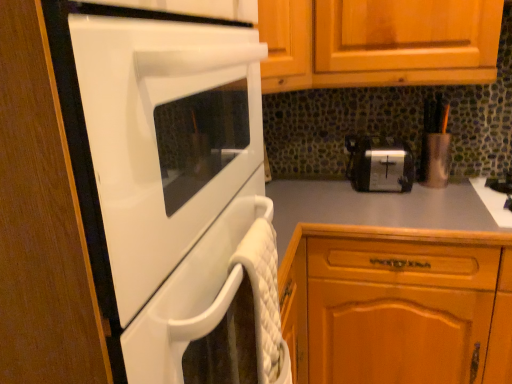
Find the location of a particular element. vacant space situated on the left part of black matte gas stove at right is located at coordinates (414, 205).